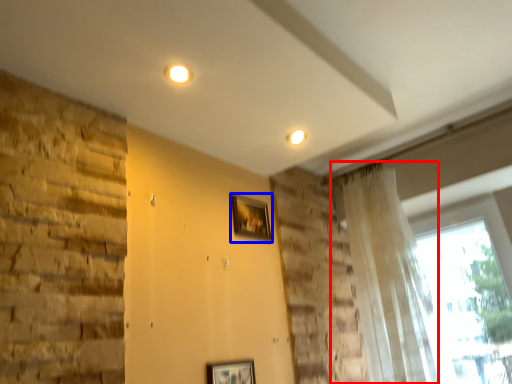
Question: Which object appears closest to the camera in this image, curtain (highlighted by a red box) or picture frame (highlighted by a blue box)?

Choices:
 (A) curtain
 (B) picture frame

Answer: (A)